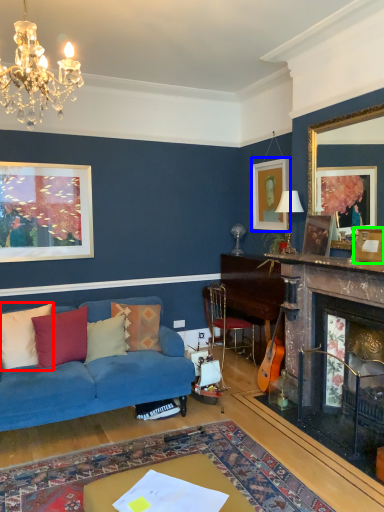
Question: Which is nearer to the pillow (highlighted by a red box)? picture frame (highlighted by a blue box) or picture frame (highlighted by a green box).

Choices:
 (A) picture frame
 (B) picture frame

Answer: (B)